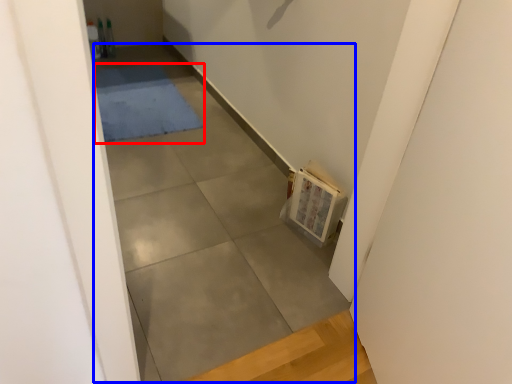
Question: Which object appears farthest to the camera in this image, mat (highlighted by a red box) or concrete (highlighted by a blue box)?

Choices:
 (A) mat
 (B) concrete

Answer: (A)